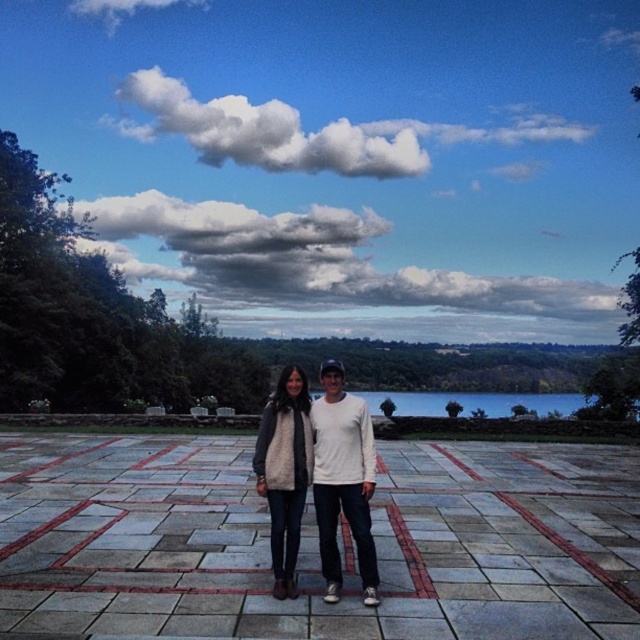
Question: Among these points, which one is farthest from the camera?

Choices:
 (A) (308, 289)
 (B) (378, 401)
 (C) (298, 384)
 (D) (321, 410)

Answer: (A)

Question: Which point appears closest to the camera in this image?

Choices:
 (A) (332, 570)
 (B) (292, 589)
 (C) (356, 280)
 (D) (548, 401)

Answer: (B)

Question: Observing the image, what is the correct spatial positioning of fuzzy white vest at center in reference to blue glass lake at center?

Choices:
 (A) below
 (B) above

Answer: (B)

Question: Among these objects, which one is farthest from the camera?

Choices:
 (A) white knit sweater at center
 (B) cloudy sky at upper center
 (C) white fluffy cloud at upper center

Answer: (C)

Question: Is white knit sweater at center bigger than blue glass lake at center?

Choices:
 (A) yes
 (B) no

Answer: (B)

Question: Does fuzzy white vest at center have a smaller size compared to blue glass lake at center?

Choices:
 (A) yes
 (B) no

Answer: (A)